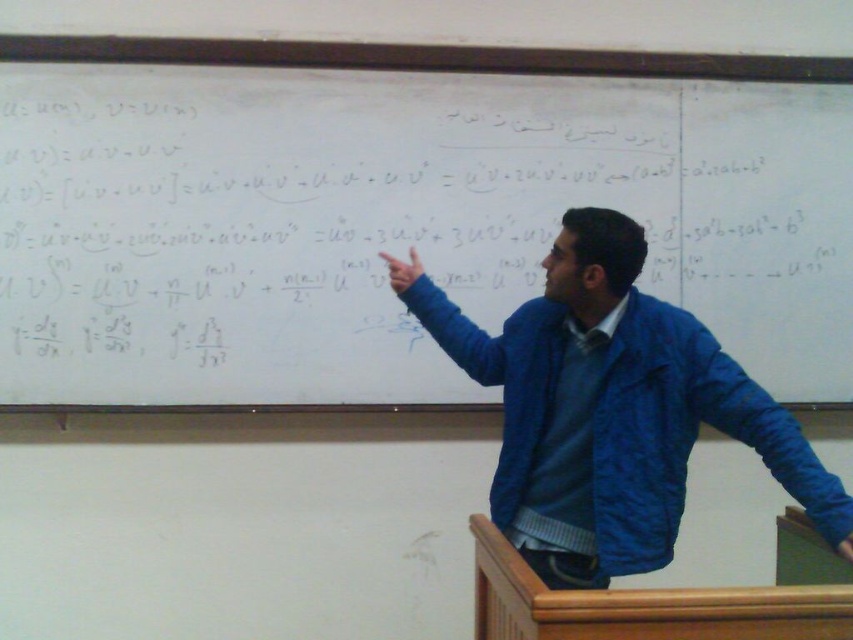
Which is more to the right, white matte board at center or blue fabric jacket at upper center?

blue fabric jacket at upper center is more to the right.

Which is in front, point (236, 401) or point (589, 349)?

Point (589, 349) is in front.

Does point (386, 115) come closer to viewer compared to point (515, 488)?

No.

Where is `white matte board at center`? The height and width of the screenshot is (640, 853). white matte board at center is located at coordinates (396, 221).